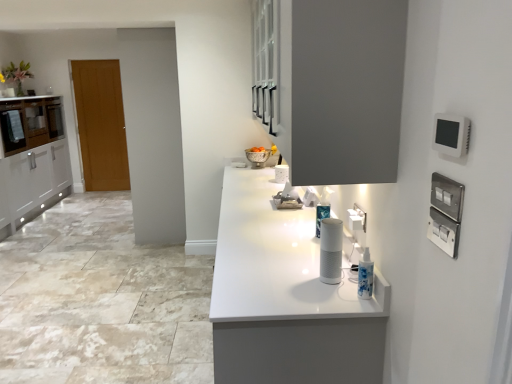
Question: Considering the positions of point click(47, 127) and point click(115, 97), is point click(47, 127) closer or farther from the camera than point click(115, 97)?

Choices:
 (A) closer
 (B) farther

Answer: (A)

Question: Is matte white cabinet at left, which is the second cabinetry in front-to-back order, wider or thinner than wooden door at left?

Choices:
 (A) thin
 (B) wide

Answer: (B)

Question: Which object is the closest to the white matte speaker at center?

Choices:
 (A) matte gray cabinet at upper center, the first cabinetry when ordered from right to left
 (B) white glossy countertop at center
 (C) matte white cabinet at left, marked as the second cabinetry in a right-to-left arrangement
 (D) silver metallic bowl at center
 (E) wooden door at left

Answer: (B)

Question: Estimate the real-world distances between objects in this image. Which object is closer to the wooden door at left?

Choices:
 (A) white matte speaker at center
 (B) silver metallic bowl at center
 (C) white plastic electric outlet at right
 (D) white glossy countertop at center
 (E) matte white cabinet at left, which is the second cabinetry in front-to-back order

Answer: (E)